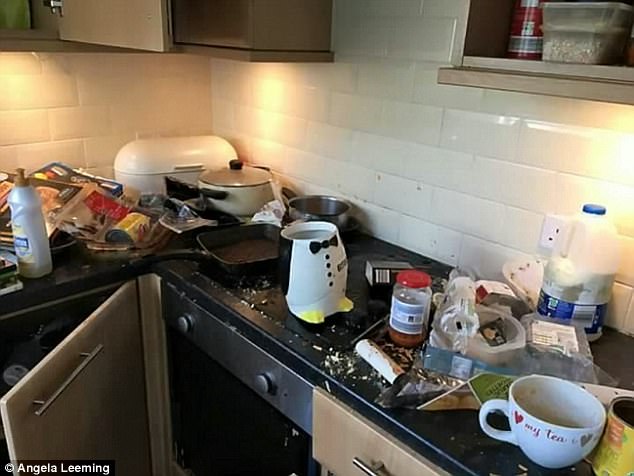
The height and width of the screenshot is (476, 634). I want to click on coffee mug, so pyautogui.click(x=541, y=432).